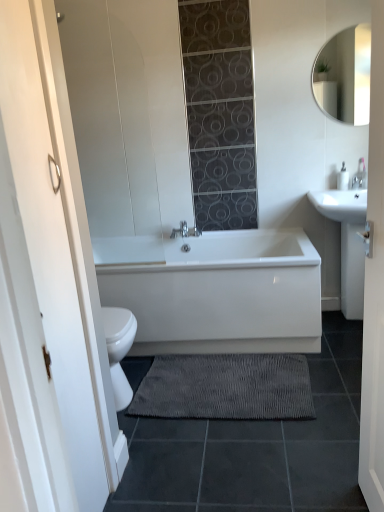
The height and width of the screenshot is (512, 384). What do you see at coordinates (374, 286) in the screenshot? I see `white wooden door at center` at bounding box center [374, 286].

Where is `gray textured bath mat at lower center`? Image resolution: width=384 pixels, height=512 pixels. gray textured bath mat at lower center is located at coordinates (226, 387).

Locate an element on the screen. This screenshot has width=384, height=512. white matte glass door at left is located at coordinates (111, 133).

At what (x,y) coordinates should I click in order to perform the action: click on white glossy bathtub at center. Please return your answer as a coordinate pair (x, y). The width and height of the screenshot is (384, 512). Looking at the image, I should click on (216, 291).

I want to click on mirror that is above the white matte glass door at left (from a real-world perspective), so click(x=344, y=76).

Can you tell me how much white glossy mirror at upper right and white matte glass door at left differ in facing direction?

There is a 0.422-degree angle between the facing directions of white glossy mirror at upper right and white matte glass door at left.

Is white glossy mirror at upper right further to the viewer compared to white matte glass door at left?

Yes.

In the scene shown: In terms of height, does white glossy mirror at upper right look taller or shorter compared to white matte glass door at left?

In the image, white glossy mirror at upper right appears to be shorter than white matte glass door at left.

At what (x,y) coordinates should I click in order to perform the action: click on sink below the white matte glass door at left (from a real-world perspective). Please return your answer as a coordinate pair (x, y). Looking at the image, I should click on (347, 242).

Is white glossy sink at right outside of white matte glass door at left?

Yes, white glossy sink at right is outside of white matte glass door at left.

Does white glossy sink at right have a lesser width compared to white matte glass door at left?

In fact, white glossy sink at right might be wider than white matte glass door at left.

Which object is further away from the camera taking this photo, white wooden door at center or white glossy mirror at upper right?

Positioned behind is white glossy mirror at upper right.

In the scene shown: In terms of size, does white wooden door at center appear bigger or smaller than white glossy mirror at upper right?

white wooden door at center is bigger than white glossy mirror at upper right.

Choose the correct answer: Is white wooden door at center inside white glossy mirror at upper right or outside it?

The correct answer is: outside.

Is white wooden door at center in contact with white glossy mirror at upper right?

No, white wooden door at center is not next to white glossy mirror at upper right.

Looking at this image, from the image's perspective, who appears lower, white glossy sink at right or white glossy mirror at upper right?

white glossy sink at right.

Is point (349, 221) less distant than point (356, 57)?

Yes, point (349, 221) is in front of point (356, 57).

Who is shorter, white glossy sink at right or white glossy mirror at upper right?

Standing shorter between the two is white glossy mirror at upper right.

Considering the sizes of objects gray textured bath mat at lower center and white glossy bathtub at center in the image provided, who is thinner, gray textured bath mat at lower center or white glossy bathtub at center?

gray textured bath mat at lower center.

Which object is further away from the camera, gray textured bath mat at lower center or white glossy bathtub at center?

white glossy bathtub at center is behind.

Is gray textured bath mat at lower center spatially inside white glossy bathtub at center, or outside of it?

gray textured bath mat at lower center is outside white glossy bathtub at center.

From the image's perspective, is gray textured bath mat at lower center located above white glossy bathtub at center?

No, from the image's perspective, gray textured bath mat at lower center is not above white glossy bathtub at center.

Is white glossy bathtub at center to the left of white glossy sink at right from the viewer's perspective?

Yes, white glossy bathtub at center is to the left of white glossy sink at right.

Is white glossy bathtub at center facing towards white glossy sink at right?

No, white glossy bathtub at center is not oriented towards white glossy sink at right.

Considering the relative sizes of white glossy bathtub at center and white glossy sink at right in the image provided, is white glossy bathtub at center bigger than white glossy sink at right?

Indeed, white glossy bathtub at center has a larger size compared to white glossy sink at right.

From the image's perspective, is white glossy bathtub at center located above or below white glossy sink at right?

white glossy bathtub at center is situated lower than white glossy sink at right in the image.

Considering the points (302, 403) and (376, 228), which point is behind, point (302, 403) or point (376, 228)?

The point (302, 403) is farther.

Based on the photo, can you tell me how much gray textured bath mat at lower center and white wooden door at center differ in facing direction?

gray textured bath mat at lower center and white wooden door at center are facing 84.9 degrees away from each other.

Where is `bath mat directly beneath the white wooden door at center (from a real-world perspective)`? The height and width of the screenshot is (512, 384). bath mat directly beneath the white wooden door at center (from a real-world perspective) is located at coordinates (226, 387).

Who is bigger, gray textured bath mat at lower center or white wooden door at center?

white wooden door at center.

The image size is (384, 512). There is a white matte glass door at left. What are the coordinates of `mirror above it (from a real-world perspective)` in the screenshot? It's located at (344, 76).

What are the coordinates of `sink that is below the white matte glass door at left (from the image's perspective)` in the screenshot? It's located at (347, 242).

From the image, which object appears to be nearer to gray textured bath mat at lower center, white glossy bathtub at center or white matte glass door at left?

white glossy bathtub at center is positioned closer to the anchor gray textured bath mat at lower center.

Considering their positions, is gray textured bath mat at lower center positioned further to white wooden door at center than white matte glass door at left?

Based on the image, white matte glass door at left appears to be further to white wooden door at center.

From the image, which object appears to be nearer to white glossy bathtub at center, white wooden door at center or white glossy sink at right?

white glossy sink at right is positioned closer to the anchor white glossy bathtub at center.

Looking at the image, which one is located further to gray textured bath mat at lower center, white wooden door at center or white matte glass door at left?

The object further to gray textured bath mat at lower center is white matte glass door at left.

Which object lies further to the anchor point white glossy bathtub at center, white glossy mirror at upper right or white matte glass door at left?

white glossy mirror at upper right is positioned further to the anchor white glossy bathtub at center.

Which object lies further to the anchor point gray textured bath mat at lower center, white wooden door at center or white glossy sink at right?

Among the two, white glossy sink at right is located further to gray textured bath mat at lower center.

When comparing their distances from gray textured bath mat at lower center, does white glossy sink at right or white glossy bathtub at center seem further?

white glossy sink at right is positioned further to the anchor gray textured bath mat at lower center.

Based on their spatial positions, is white glossy mirror at upper right or white wooden door at center closer to white glossy sink at right?

The object closer to white glossy sink at right is white glossy mirror at upper right.

In order to click on glass door located between white wooden door at center and white glossy sink at right in the depth direction in this screenshot , I will do `click(111, 133)`.

Where is `bath mat between white glossy bathtub at center and white glossy sink at right`? bath mat between white glossy bathtub at center and white glossy sink at right is located at coordinates (226, 387).

Where is `bath mat between white wooden door at center and white glossy mirror at upper right in the front-back direction`? bath mat between white wooden door at center and white glossy mirror at upper right in the front-back direction is located at coordinates click(x=226, y=387).

At what (x,y) coordinates should I click in order to perform the action: click on sink between white wooden door at center and white glossy mirror at upper right in the front-back direction. Please return your answer as a coordinate pair (x, y). Looking at the image, I should click on (347, 242).